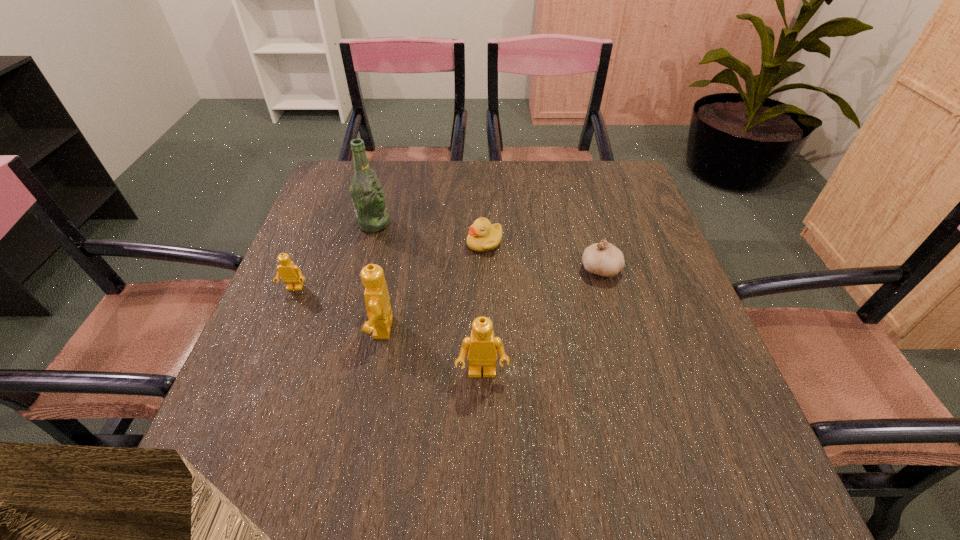
Given the evenly spaced Legos in the image, where should an extra Lego be added on the right to preserve the spacing? Please point to a vacant space. Please provide its 2D coordinates. Your answer should be formatted as a tuple, i.e. [(x, y)], where the tuple contains the x and y coordinates of a point satisfying the conditions above.

[(605, 429)]